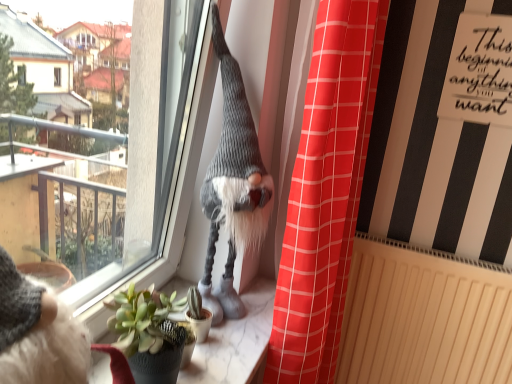
Question: Is red plaid curtain at center directly adjacent to marble at center?

Choices:
 (A) no
 (B) yes

Answer: (A)

Question: From a real-world perspective, is red plaid curtain at center on marble at center?

Choices:
 (A) yes
 (B) no

Answer: (A)

Question: Is red plaid curtain at center at the right side of marble at center?

Choices:
 (A) yes
 (B) no

Answer: (A)

Question: Can you confirm if red plaid curtain at center is taller than marble at center?

Choices:
 (A) yes
 (B) no

Answer: (A)

Question: From the image's perspective, is red plaid curtain at center on marble at center?

Choices:
 (A) no
 (B) yes

Answer: (B)

Question: Could marble at center be considered to be inside red plaid curtain at center?

Choices:
 (A) no
 (B) yes

Answer: (A)

Question: Is transparent glass window at upper center in front of marble at center?

Choices:
 (A) yes
 (B) no

Answer: (A)

Question: Is transparent glass window at upper center further to camera compared to marble at center?

Choices:
 (A) yes
 (B) no

Answer: (B)

Question: Is transparent glass window at upper center at the left side of marble at center?

Choices:
 (A) no
 (B) yes

Answer: (B)

Question: Considering the relative sizes of transparent glass window at upper center and marble at center in the image provided, is transparent glass window at upper center wider than marble at center?

Choices:
 (A) yes
 (B) no

Answer: (B)

Question: Can marble at center be found inside transparent glass window at upper center?

Choices:
 (A) yes
 (B) no

Answer: (B)

Question: From a real-world perspective, is transparent glass window at upper center positioned under marble at center based on gravity?

Choices:
 (A) no
 (B) yes

Answer: (A)

Question: From a real-world perspective, does beige textured radiator at lower right sit lower than marble at center?

Choices:
 (A) no
 (B) yes

Answer: (B)